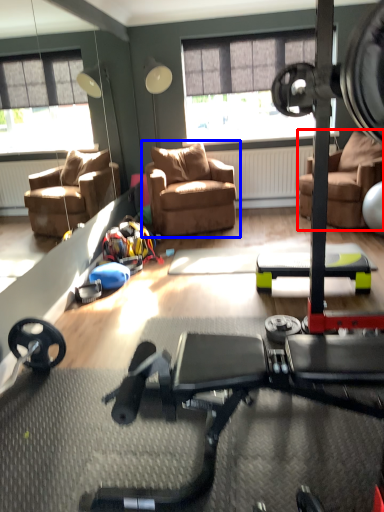
Question: Which object appears closest to the camera in this image, chair (highlighted by a red box) or chair (highlighted by a blue box)?

Choices:
 (A) chair
 (B) chair

Answer: (A)